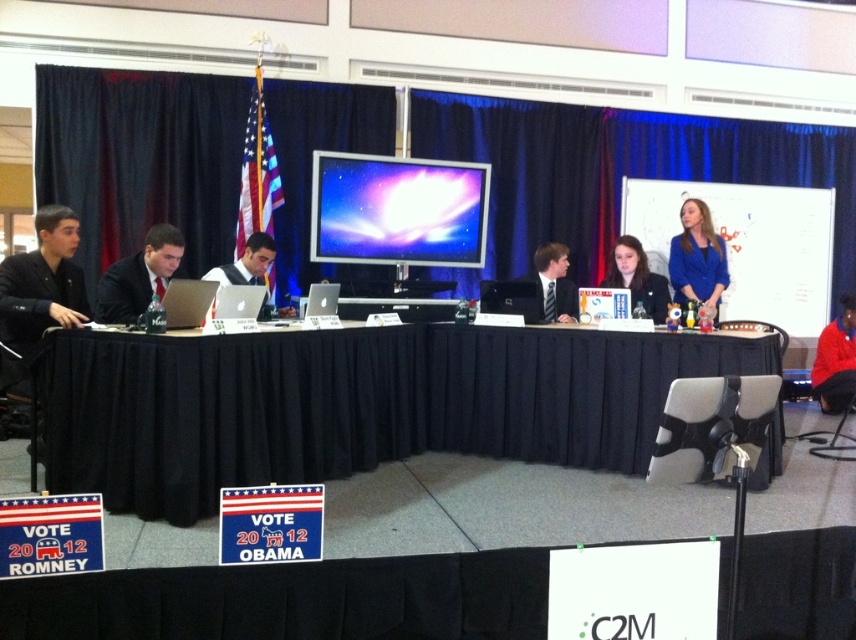
Who is more forward, (x=837, y=392) or (x=577, y=312)?

Point (x=577, y=312) is more forward.

Between red sweater at lower right and matte black tie at center, which one appears on the right side from the viewer's perspective?

Positioned to the right is red sweater at lower right.

Is point (818, 364) positioned after point (526, 276)?

Yes, it is behind point (526, 276).

This screenshot has width=856, height=640. Find the location of `red sweater at lower right`. red sweater at lower right is located at coordinates (835, 360).

Can you confirm if whiteboard at upper right is positioned below matte plastic screen at center?

Yes.

In the scene shown: Can you confirm if whiteboard at upper right is positioned to the left of matte plastic screen at center?

In fact, whiteboard at upper right is to the right of matte plastic screen at center.

Which is in front, point (806, 195) or point (337, 157)?

Positioned in front is point (337, 157).

What are the coordinates of `whiteboard at upper right` in the screenshot? It's located at (750, 244).

Is black fabric curtain at upper center below matte blue shirt at center?

No, black fabric curtain at upper center is not below matte blue shirt at center.

Is point (425, 115) farther from viewer compared to point (629, 257)?

Yes, it is behind point (629, 257).

Describe the element at coordinates (615, 170) in the screenshot. I see `black fabric curtain at upper center` at that location.

Find the location of a particular element. black fabric curtain at upper center is located at coordinates (615, 170).